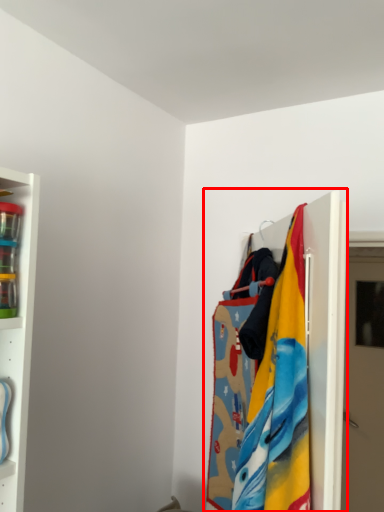
Question: From the image's perspective, what is the correct spatial relationship of closet (annotated by the red box) in relation to door?

Choices:
 (A) above
 (B) below

Answer: (A)